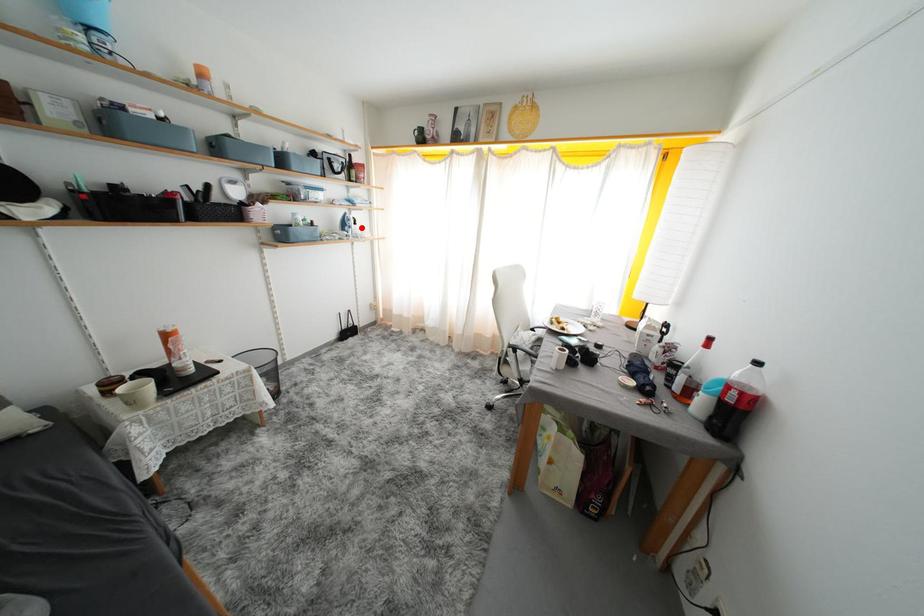
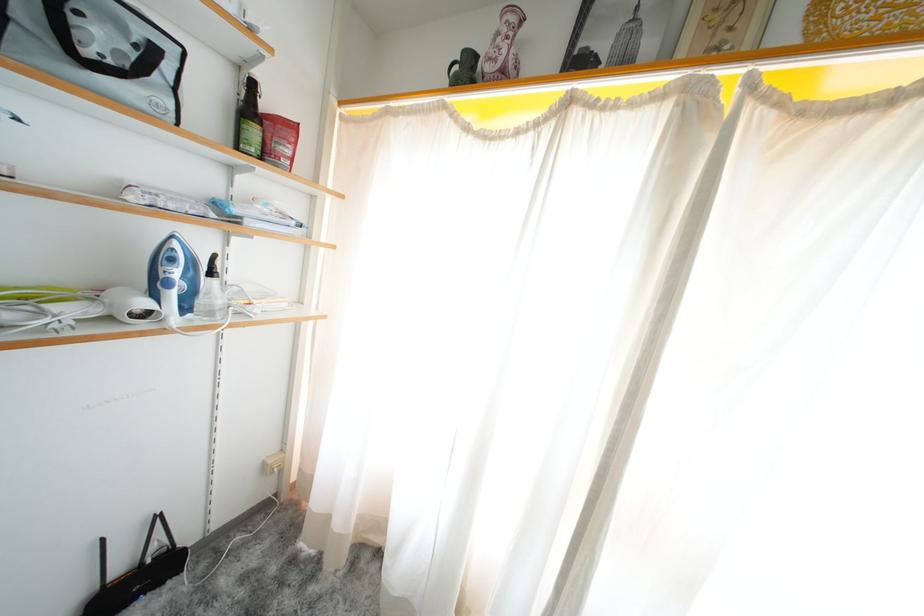
Where in the second image is the point corresponding to the highlighted location from the first image?

(217, 278)